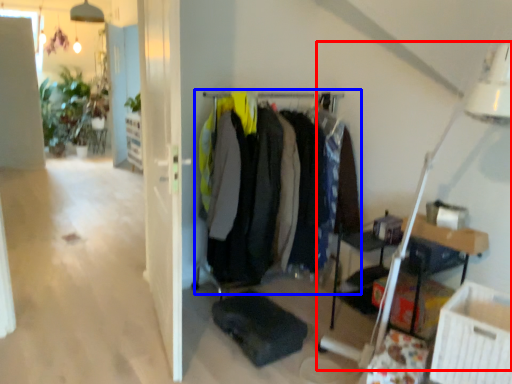
Question: Which of the following is the farthest to the observer, table lamp (highlighted by a red box) or closet (highlighted by a blue box)?

Choices:
 (A) table lamp
 (B) closet

Answer: (B)